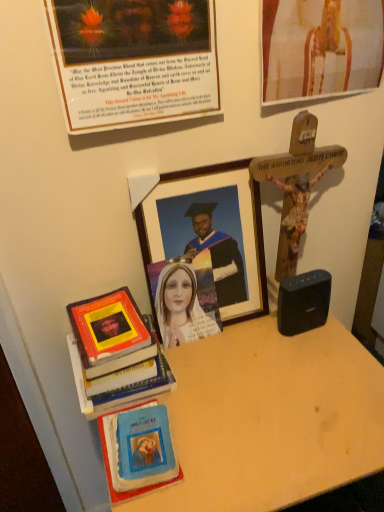
Question: Considering the relative positions of hardcover book at left, arranged as the first book when viewed from the top, and wooden picture frame at center, which is the 1th picture frame from bottom to top, in the image provided, is hardcover book at left, arranged as the first book when viewed from the top, to the left of wooden picture frame at center, which is the 1th picture frame from bottom to top, from the viewer's perspective?

Choices:
 (A) no
 (B) yes

Answer: (B)

Question: Is the surface of hardcover book at left, which appears as the second book when ordered from the bottom, in direct contact with wooden picture frame at center, which is the 1th picture frame from bottom to top?

Choices:
 (A) no
 (B) yes

Answer: (A)

Question: Can you confirm if hardcover book at left, arranged as the first book when viewed from the top, is positioned to the right of wooden picture frame at center, which is the 1th picture frame from bottom to top?

Choices:
 (A) no
 (B) yes

Answer: (A)

Question: Can you confirm if hardcover book at left, which appears as the second book when ordered from the bottom, is taller than wooden picture frame at center, acting as the third picture frame starting from the top?

Choices:
 (A) yes
 (B) no

Answer: (B)

Question: Does hardcover book at left, arranged as the first book when viewed from the top, come behind wooden picture frame at center, acting as the third picture frame starting from the top?

Choices:
 (A) no
 (B) yes

Answer: (A)

Question: Considering the positions of matte paper portrait at center and wooden table at lower left in the image, is matte paper portrait at center wider or thinner than wooden table at lower left?

Choices:
 (A) thin
 (B) wide

Answer: (A)

Question: Is matte paper portrait at center to the left or to the right of wooden table at lower left in the image?

Choices:
 (A) right
 (B) left

Answer: (B)

Question: From the image's perspective, relative to wooden table at lower left, is matte paper portrait at center above or below?

Choices:
 (A) below
 (B) above

Answer: (B)

Question: Is matte paper portrait at center in front of or behind wooden table at lower left in the image?

Choices:
 (A) front
 (B) behind

Answer: (B)

Question: Looking at the image, does matte paper picture frame at upper left, which is the 2th picture frame in bottom-to-top order, seem bigger or smaller compared to wooden picture frame at center, which is the 1th picture frame from bottom to top?

Choices:
 (A) small
 (B) big

Answer: (A)

Question: From the image's perspective, relative to wooden picture frame at center, which is the 1th picture frame from bottom to top, is matte paper picture frame at upper left, which is the 2th picture frame in bottom-to-top order, above or below?

Choices:
 (A) below
 (B) above

Answer: (B)

Question: In the image, is matte paper picture frame at upper left, which is the 2th picture frame in bottom-to-top order, positioned in front of or behind wooden picture frame at center, acting as the third picture frame starting from the top?

Choices:
 (A) behind
 (B) front

Answer: (B)

Question: Is matte paper picture frame at upper left, which is the 2th picture frame in bottom-to-top order, inside or outside of wooden picture frame at center, which is the 1th picture frame from bottom to top?

Choices:
 (A) outside
 (B) inside

Answer: (A)

Question: In the image, is wooden crucifix at upper right, the 1th picture frame positioned from the top, positioned in front of or behind black plastic speaker at right?

Choices:
 (A) behind
 (B) front

Answer: (B)

Question: From their relative heights in the image, would you say wooden crucifix at upper right, the 1th picture frame positioned from the top, is taller or shorter than black plastic speaker at right?

Choices:
 (A) tall
 (B) short

Answer: (A)